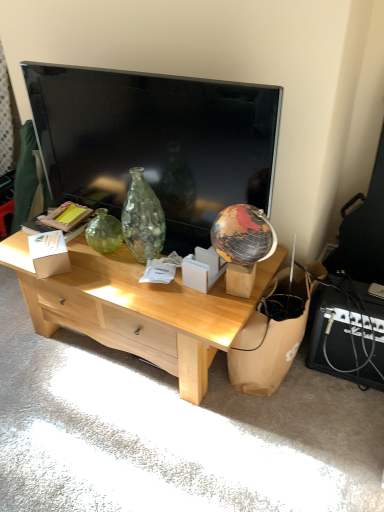
Question: Considering the positions of brown paper bag at lower right and white cardboard box at center, which is the 2th cardboard box in left-to-right order, in the image, is brown paper bag at lower right bigger or smaller than white cardboard box at center, which is the 2th cardboard box in left-to-right order,?

Choices:
 (A) small
 (B) big

Answer: (B)

Question: Considering the relative positions of brown paper bag at lower right and white cardboard box at center, the first cardboard box in the right-to-left sequence, in the image provided, is brown paper bag at lower right to the left or to the right of white cardboard box at center, the first cardboard box in the right-to-left sequence,?

Choices:
 (A) right
 (B) left

Answer: (A)

Question: Which object is positioned farthest from the flat screen tv at upper center?

Choices:
 (A) brown paper bag at lower right
 (B) white cardboard box at center, the first cardboard box in the right-to-left sequence
 (C) light wood desk at center
 (D) white cardboard box at center, which is the first cardboard box from left to right

Answer: (A)

Question: Estimate the real-world distances between objects in this image. Which object is closer to the flat screen tv at upper center?

Choices:
 (A) white cardboard box at center, marked as the 2th cardboard box in a right-to-left arrangement
 (B) white cardboard box at center, which is the 2th cardboard box in left-to-right order
 (C) brown paper bag at lower right
 (D) light wood desk at center

Answer: (D)